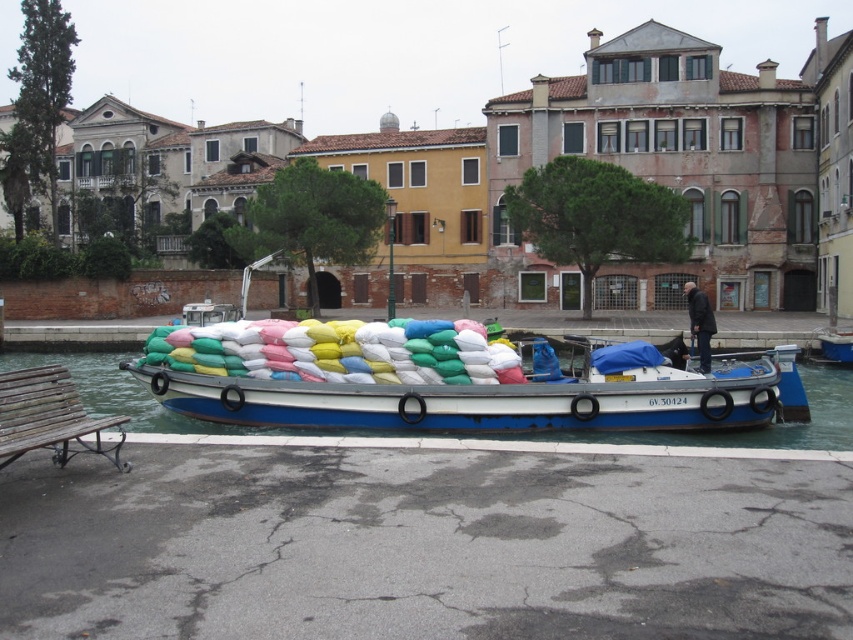
Question: Does blue painted wood boat at center have a larger size compared to dark gray jacket at center?

Choices:
 (A) no
 (B) yes

Answer: (A)

Question: Among these objects, which one is farthest from the camera?

Choices:
 (A) blue painted wood boat at center
 (B) dark gray jacket at center

Answer: (B)

Question: Which point is closer to the camera?

Choices:
 (A) blue painted wood boat at center
 (B) wooden bench at lower left
 (C) dark gray jacket at center

Answer: (B)

Question: Is blue painted wood boat at center to the left of wooden bench at lower left from the viewer's perspective?

Choices:
 (A) no
 (B) yes

Answer: (A)

Question: Which of the following is the farthest from the observer?

Choices:
 (A) wooden bench at lower left
 (B) dark gray jacket at center

Answer: (B)

Question: Does wooden bench at lower left appear over dark gray jacket at center?

Choices:
 (A) no
 (B) yes

Answer: (A)